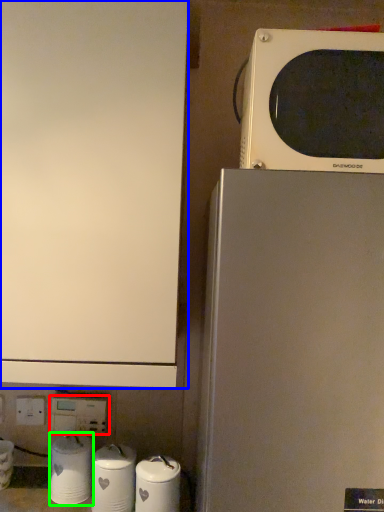
Question: Considering the real-world distances, which object is farthest from electric outlet (highlighted by a red box)? home appliance (highlighted by a blue box) or appliance (highlighted by a green box)?

Choices:
 (A) home appliance
 (B) appliance

Answer: (A)